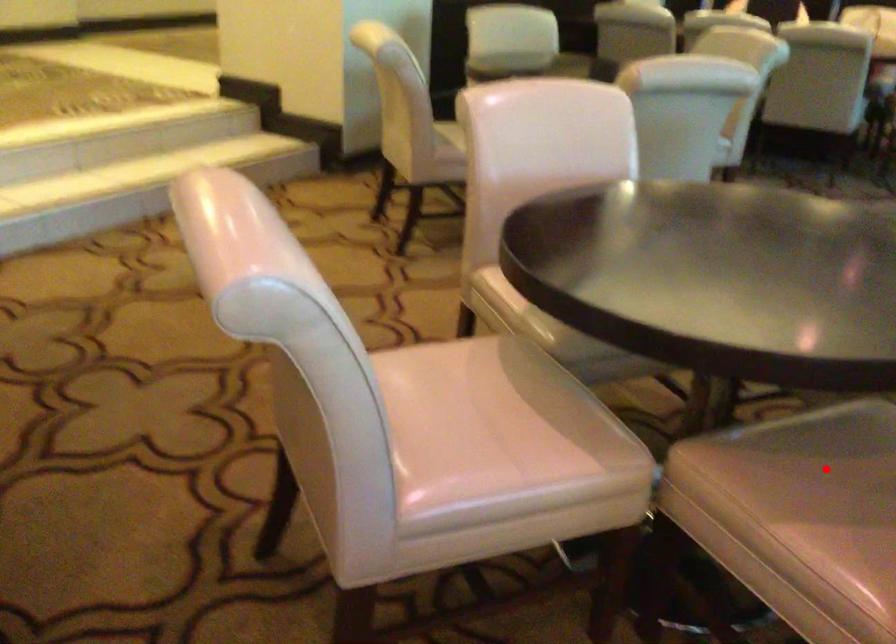
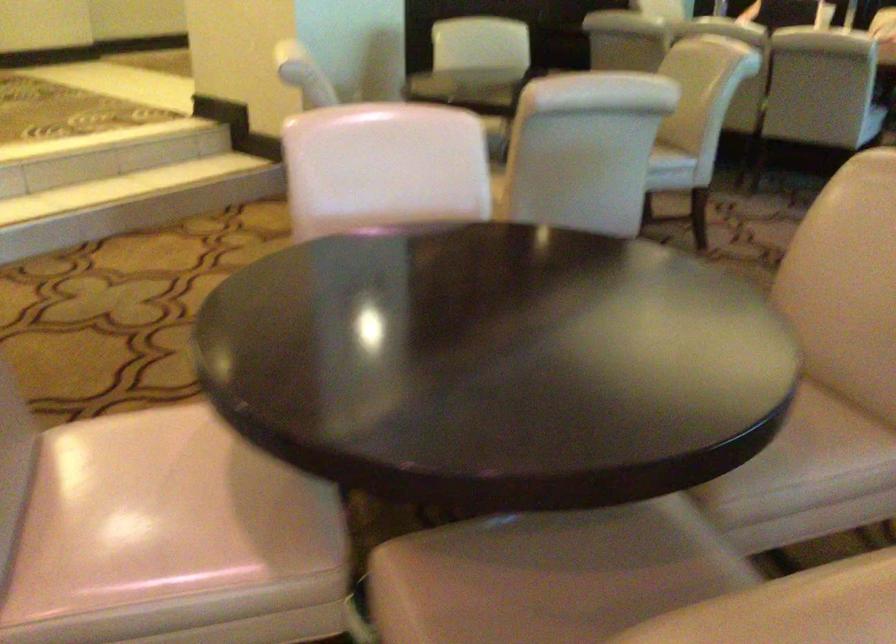
Question: I am providing you with two images of the same scene from different viewpoints. In image1, a red point is highlighted. Considering the same 3D point in image2, which of the following is correct?

Choices:
 (A) It is closer
 (B) It is farther

Answer: (A)